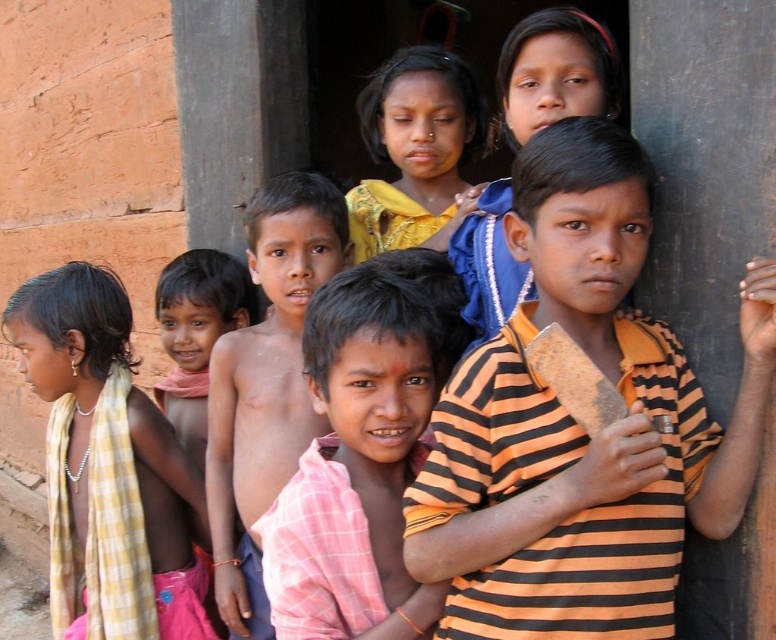
Question: Which of the following is the farthest from the observer?

Choices:
 (A) yellow fabric at center
 (B) pink checkered shirt at center
 (C) yellow checkered cloth at left
 (D) orange striped shirt at center

Answer: (C)

Question: Which point is closer to the camera taking this photo?

Choices:
 (A) (442, 81)
 (B) (314, 198)
 (C) (598, 163)
 (D) (179, 541)

Answer: (C)

Question: Is orange striped shirt at center thinner than yellow fabric at center?

Choices:
 (A) no
 (B) yes

Answer: (A)

Question: Does orange striped shirt at center have a smaller size compared to shiny skin boy at center?

Choices:
 (A) yes
 (B) no

Answer: (B)

Question: Does pink checkered shirt at center come in front of shiny skin boy at center?

Choices:
 (A) yes
 (B) no

Answer: (A)

Question: Which object appears closest to the camera in this image?

Choices:
 (A) orange striped shirt at center
 (B) pink checkered shirt at center

Answer: (A)